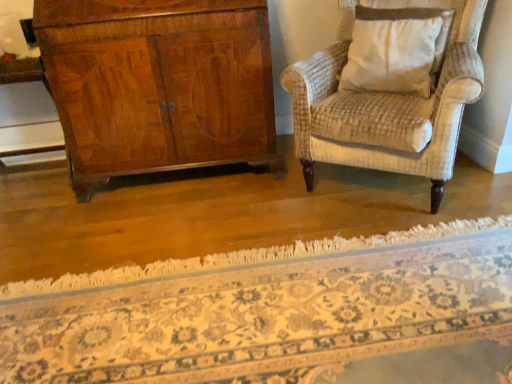
The image size is (512, 384). I want to click on vacant point above floral carpet at center (from a real-world perspective), so [x=203, y=248].